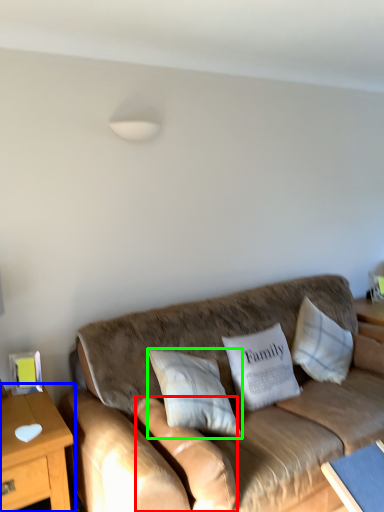
Question: Which object is positioned farthest from pillow (highlighted by a red box)? Select from table (highlighted by a blue box) and pillow (highlighted by a green box).

Choices:
 (A) table
 (B) pillow

Answer: (A)